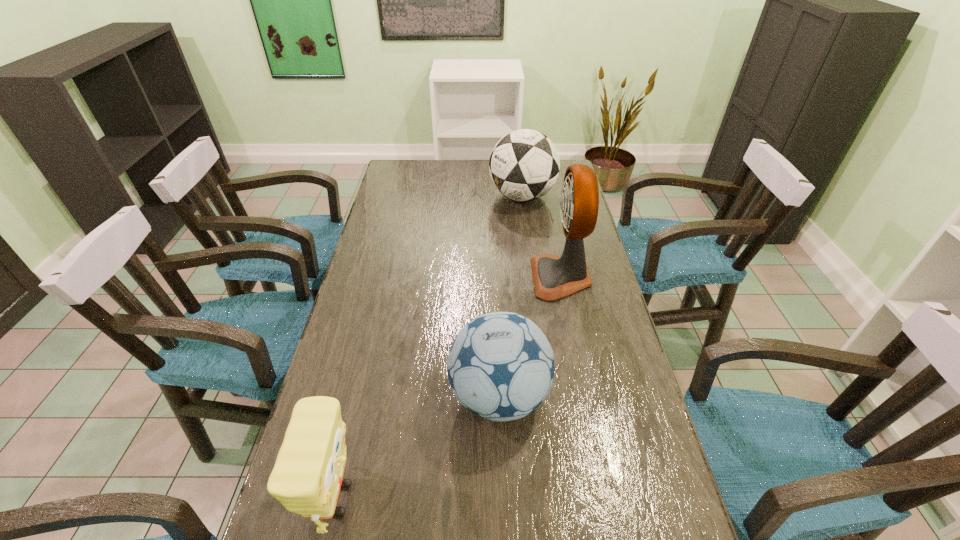
This screenshot has height=540, width=960. I want to click on vacant space located 0.240m on the side with brand of the nearer soccer ball, so click(351, 396).

Locate an element on the screen. The width and height of the screenshot is (960, 540). vacant space located 0.210m on the side with brand of the nearer soccer ball is located at coordinates (364, 396).

At what (x,y) coordinates should I click in order to perform the action: click on vacant area situated 0.170m on the side with brand of the nearer soccer ball. Please return your answer as a coordinate pair (x, y). Looking at the image, I should click on (380, 396).

Identify the location of object at the far edge. This screenshot has height=540, width=960. (524, 165).

Find the location of `fan present at the right edge`. fan present at the right edge is located at coordinates (554, 277).

Where is `soccer ball that is at the right edge`? This screenshot has width=960, height=540. soccer ball that is at the right edge is located at coordinates (524, 165).

Find the location of a particular element. This screenshot has height=540, width=960. object that is positioned at the far right corner is located at coordinates (524, 165).

The image size is (960, 540). I want to click on free space at the far edge of the desktop, so click(x=471, y=164).

Identify the location of free space at the left edge. (410, 207).

Where is `vacant space at the right edge of the desktop`? This screenshot has width=960, height=540. vacant space at the right edge of the desktop is located at coordinates (612, 431).